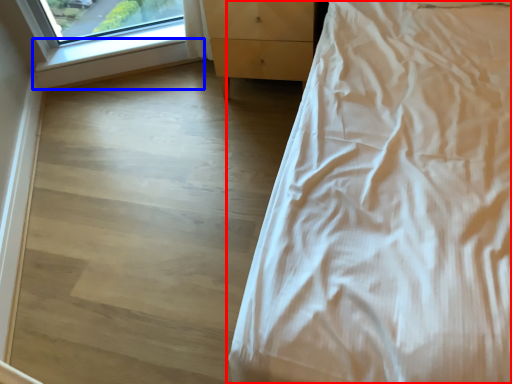
Question: Which object appears farthest to the camera in this image, bed (highlighted by a red box) or window sill (highlighted by a blue box)?

Choices:
 (A) bed
 (B) window sill

Answer: (B)